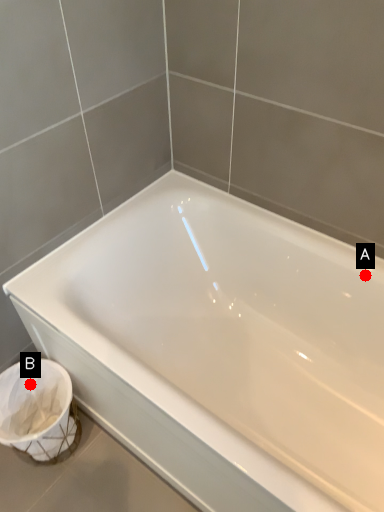
Question: Two points are circled on the image, labeled by A and B beside each circle. Which point appears closest to the camera in this image?

Choices:
 (A) A is closer
 (B) B is closer

Answer: (A)